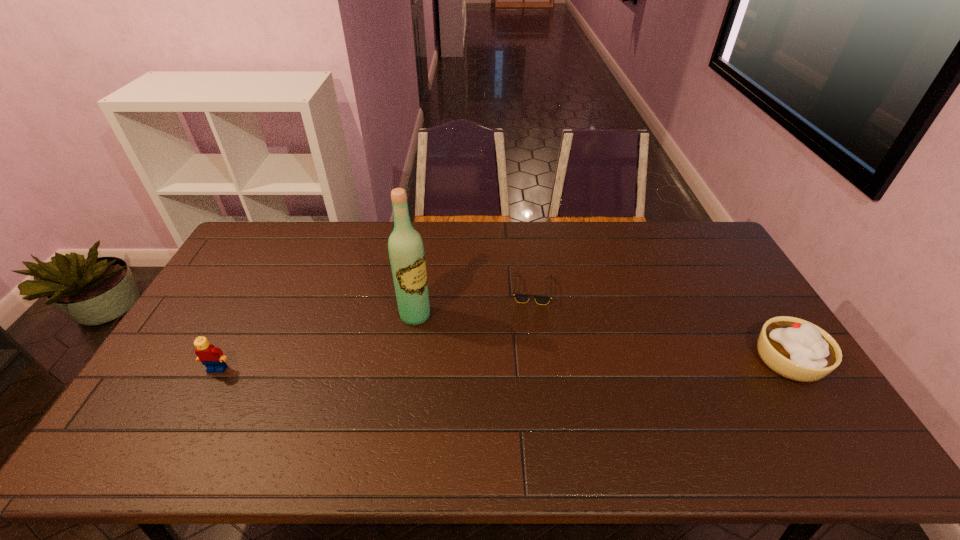
The image size is (960, 540). In order to click on vacant space located 0.390m on the lenses of the shortest object in this screenshot , I will do `click(608, 408)`.

The image size is (960, 540). What are the coordinates of `vacant space situated 0.240m on the front-facing side of the wine bottle` in the screenshot? It's located at (485, 367).

Locate an element on the screen. The height and width of the screenshot is (540, 960). vacant position located 0.320m on the front-facing side of the wine bottle is located at coordinates (507, 383).

This screenshot has width=960, height=540. I want to click on free region located on the front-facing side of the wine bottle, so click(524, 396).

Locate an element on the screen. object that is at the left edge is located at coordinates (212, 357).

What are the coordinates of `object present at the right edge` in the screenshot? It's located at (796, 349).

In the image, there is a desktop. Identify the location of vacant area at the far edge. The image size is (960, 540). (366, 248).

Where is `free space at the near edge of the desktop`? Image resolution: width=960 pixels, height=540 pixels. free space at the near edge of the desktop is located at coordinates (535, 411).

I want to click on free point at the left edge, so click(x=256, y=300).

This screenshot has height=540, width=960. In order to click on vacant space at the right edge in this screenshot , I will do `click(708, 285)`.